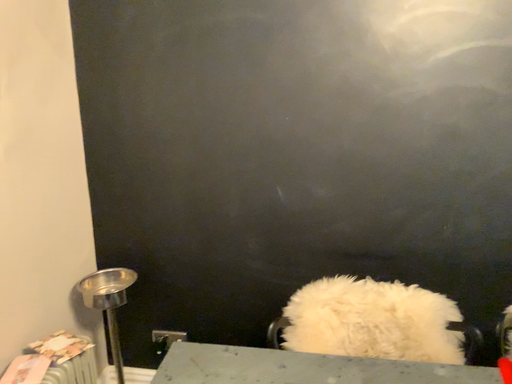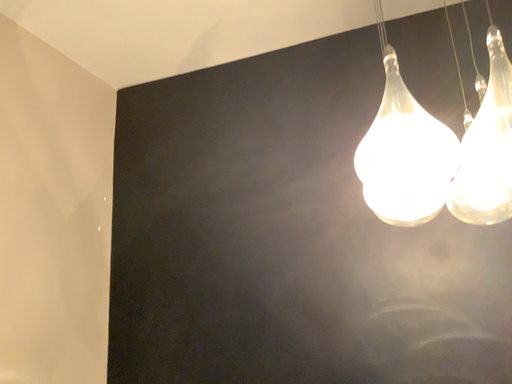
Question: How did the camera likely rotate when shooting the video?

Choices:
 (A) rotated downward
 (B) rotated upward

Answer: (B)